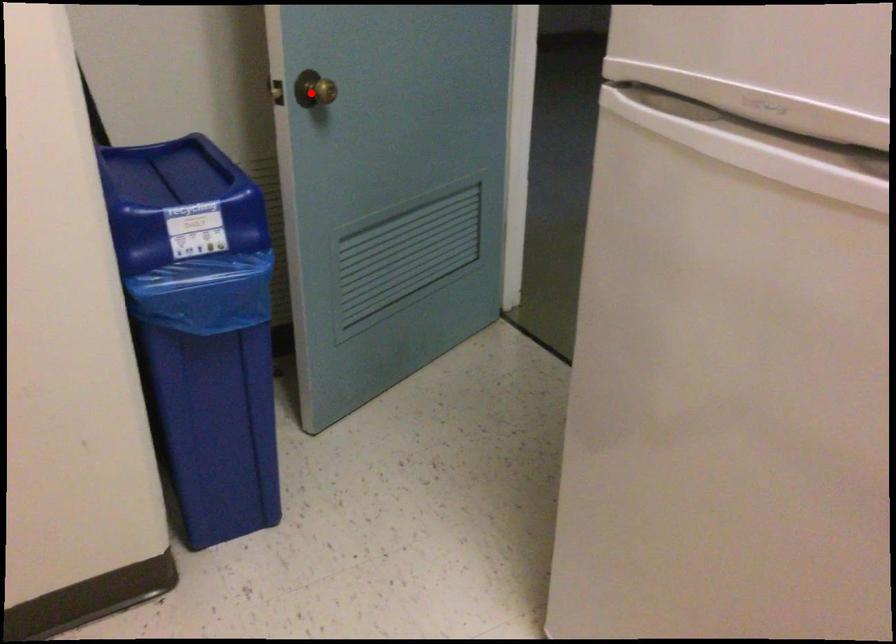
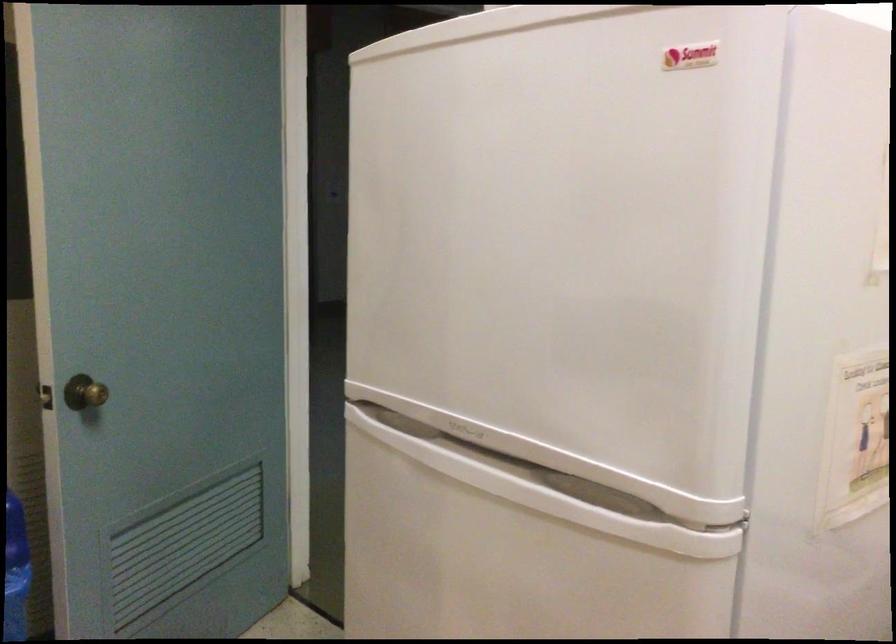
The point at the highlighted location is marked in the first image. Where is the corresponding point in the second image?

(85, 393)